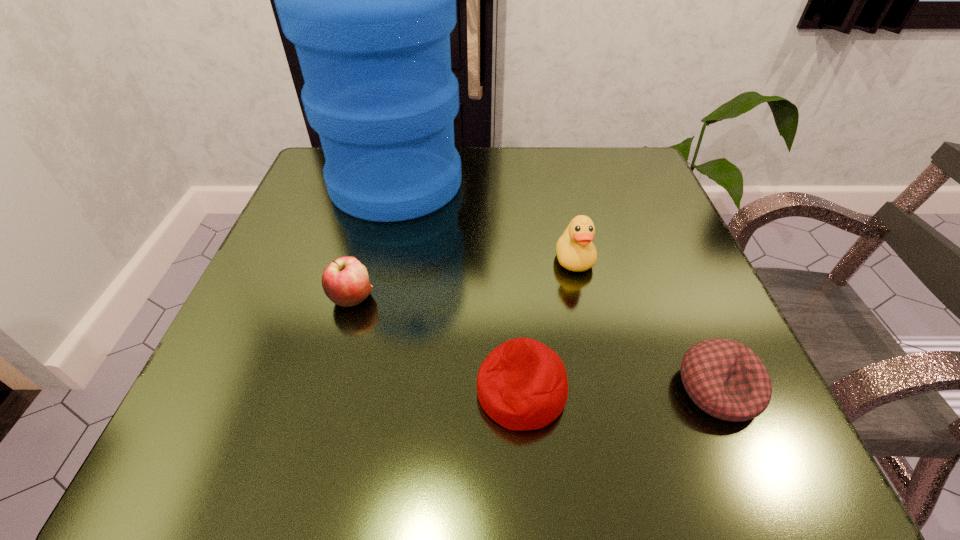
Find the location of a particular element. free space at the far edge of the desktop is located at coordinates (583, 200).

The width and height of the screenshot is (960, 540). Identify the location of vacant area at the left edge of the desktop. (269, 317).

The width and height of the screenshot is (960, 540). In order to click on free space at the right edge in this screenshot , I will do `click(673, 390)`.

At what (x,y) coordinates should I click in order to perform the action: click on vacant space at the far left corner of the desktop. Please return your answer as a coordinate pair (x, y). Looking at the image, I should click on (319, 188).

The height and width of the screenshot is (540, 960). Find the location of `vacant space at the far right corner`. vacant space at the far right corner is located at coordinates (618, 153).

This screenshot has width=960, height=540. What are the coordinates of `vacant space that is in between the left beanbag and the right beanbag` in the screenshot? It's located at (619, 390).

The width and height of the screenshot is (960, 540). Identify the location of free space between the right beanbag and the third object from left to right. (619, 390).

In order to click on free spot between the left beanbag and the fourth shortest object in this screenshot , I will do `click(547, 325)`.

Locate an element on the screen. blank region between the apple and the tallest object is located at coordinates (374, 240).

Where is `blank region between the third object from right to left and the second farthest object`? The image size is (960, 540). blank region between the third object from right to left and the second farthest object is located at coordinates (547, 325).